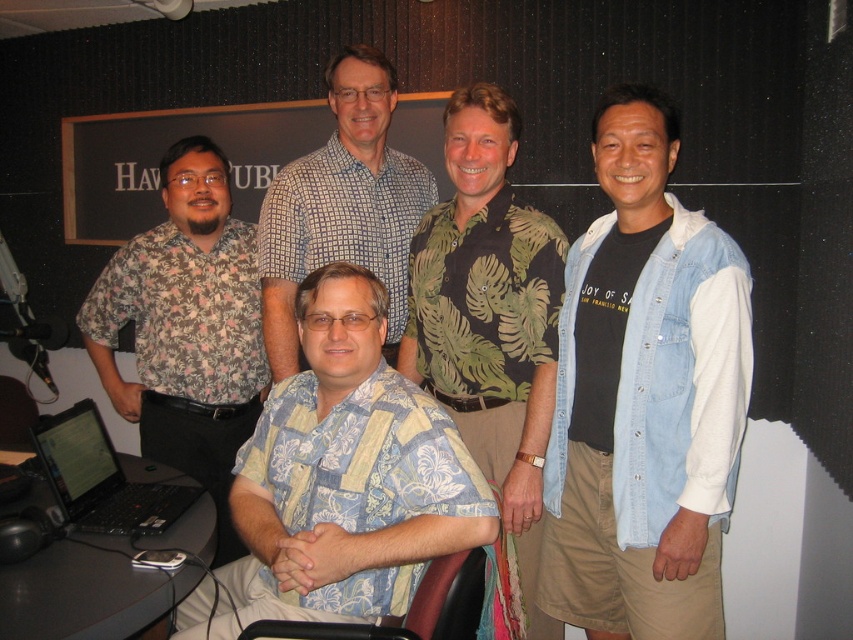
Question: Which is farther from the blue floral shirt at center?

Choices:
 (A) black wood signboard at upper center
 (B) black leather swivel chair at lower center

Answer: (A)

Question: From the image, what is the correct spatial relationship of green leafy shirt at center in relation to checkered shirt at center?

Choices:
 (A) above
 (B) below

Answer: (B)

Question: Among these objects, which one is farthest from the camera?

Choices:
 (A) black glossy laptop at lower left
 (B) black wood signboard at upper center

Answer: (B)

Question: Observing the image, what is the correct spatial positioning of blue floral shirt at center in reference to checkered shirt at center?

Choices:
 (A) below
 (B) above

Answer: (A)

Question: Which point is farther to the camera?

Choices:
 (A) (321, 152)
 (B) (259, 444)

Answer: (A)

Question: Can you confirm if denim vest at right is positioned above black glossy laptop at lower left?

Choices:
 (A) yes
 (B) no

Answer: (A)